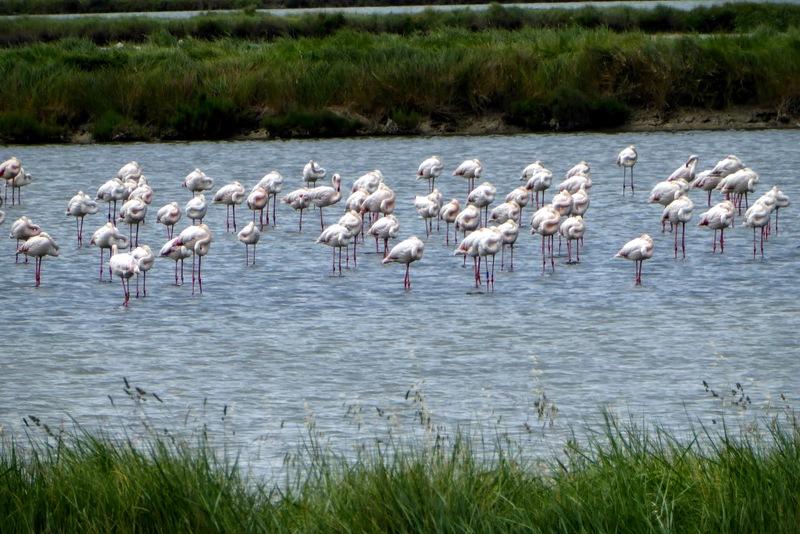
The image size is (800, 534). I want to click on white plant, so click(x=120, y=44).